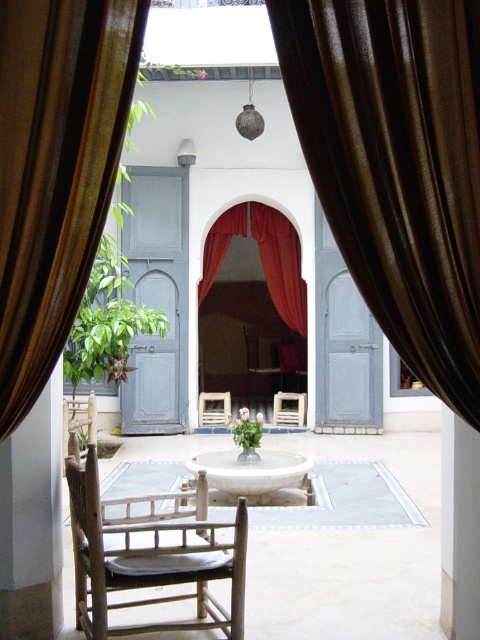
Which of these two, brown silk curtain at center or wooden rocking chair at center, stands taller?

Standing taller between the two is brown silk curtain at center.

Measure the distance between brown silk curtain at center and wooden rocking chair at center.

brown silk curtain at center is 1.83 meters from wooden rocking chair at center.

I want to click on brown silk curtain at center, so click(396, 164).

Who is shorter, brown sheer curtain at left or velvet red curtain at center?

brown sheer curtain at left

The image size is (480, 640). Describe the element at coordinates (56, 170) in the screenshot. I see `brown sheer curtain at left` at that location.

Find the location of a particular element. brown sheer curtain at left is located at coordinates (56, 170).

Locate an element on the screen. brown sheer curtain at left is located at coordinates (56, 170).

Is wooden rocking chair at center behind green glossy plant at center?

That is False.

Where is `wooden rocking chair at center`? The image size is (480, 640). wooden rocking chair at center is located at coordinates (151, 560).

The height and width of the screenshot is (640, 480). Identify the location of wooden rocking chair at center. (151, 560).